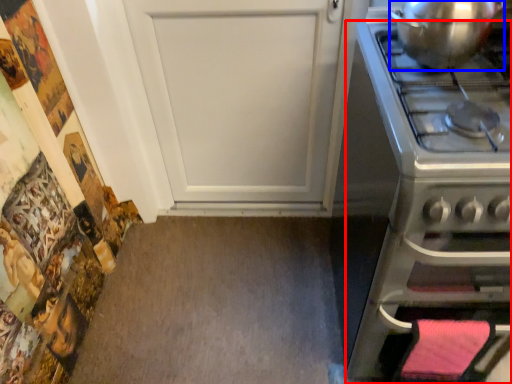
Question: Among these objects, which one is farthest to the camera, oven (highlighted by a red box) or kitchen appliance (highlighted by a blue box)?

Choices:
 (A) oven
 (B) kitchen appliance

Answer: (B)